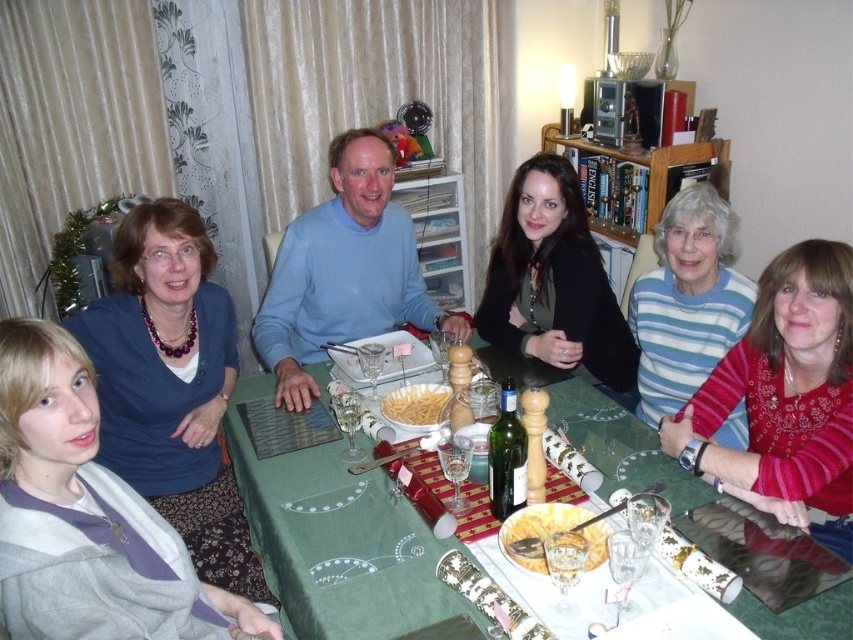
Is green fabric table at center below light blue sweater at center?

Yes.

Is green fabric table at center bigger than light blue sweater at center?

No, green fabric table at center is not bigger than light blue sweater at center.

Where is `green fabric table at center`? green fabric table at center is located at coordinates (329, 548).

Who is lower down, light blue sweater at center or striped sweater at center?

striped sweater at center

Image resolution: width=853 pixels, height=640 pixels. Identify the location of light blue sweater at center. (344, 272).

The image size is (853, 640). I want to click on light blue sweater at center, so (344, 272).

Which is above, black matte jacket at center or striped sweater at center?

Positioned higher is black matte jacket at center.

Is point (593, 253) positioned behind point (747, 278)?

No, (593, 253) is in front of (747, 278).

Looking at this image, measure the distance between black matte jacket at center and camera.

black matte jacket at center is 2.09 meters from camera.

At what (x,y) coordinates should I click in order to perform the action: click on black matte jacket at center. Please return your answer as a coordinate pair (x, y). The image size is (853, 640). Looking at the image, I should click on 554,282.